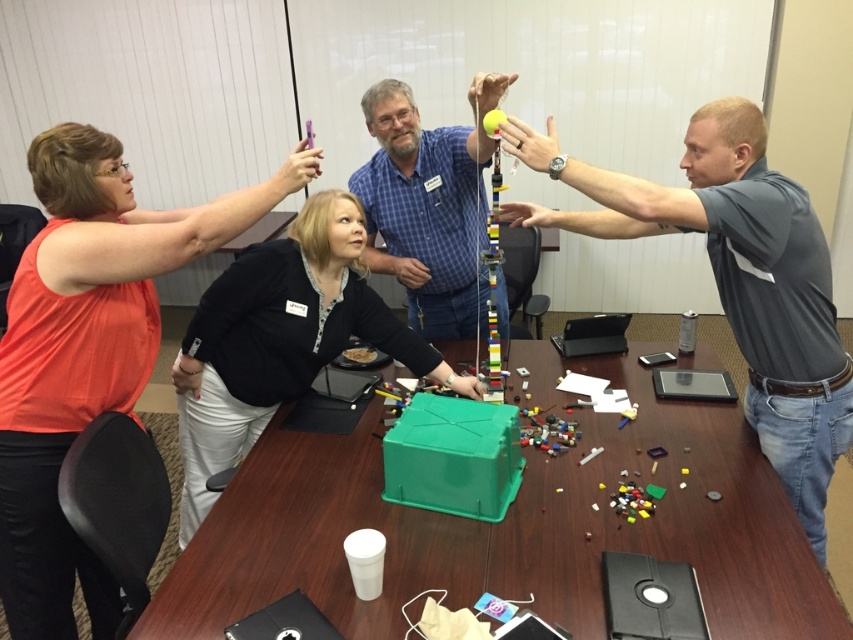
You are organizing a team building activity and need to ensure there is enough space for everyone. The gray fabric shirt at right and the black matte jacket at center are two participants. Which participant takes up more physical space in the scene?

The gray fabric shirt at right is larger in size than the black matte jacket at center, so the participant wearing the gray fabric shirt at right takes up more physical space in the scene.

You are trying to place a large project board on the green plastic table at center. The board is as wide as the blue plaid shirt at center. Will it fit on the table?

The green plastic table at center might be wider than blue plaid shirt at center, so the project board, which is as wide as the blue plaid shirt at center, might fit on the table.

You are standing at the entrance of the room and see the green plastic table at center and the blue plaid shirt at center. Which object is located to the right when facing the scene?

The green plastic table at center is to the right of the blue plaid shirt at center.